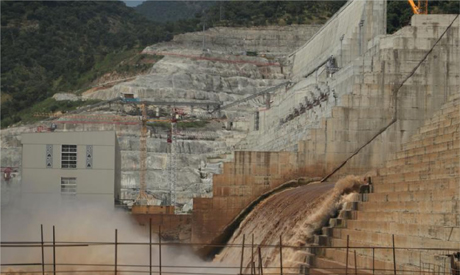
Where is `stairs`? Image resolution: width=460 pixels, height=275 pixels. stairs is located at coordinates (411, 208), (370, 65).